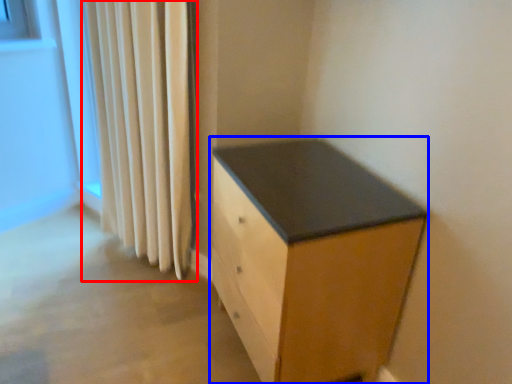
Question: Which object is further to the camera taking this photo, curtain (highlighted by a red box) or chest of drawers (highlighted by a blue box)?

Choices:
 (A) curtain
 (B) chest of drawers

Answer: (A)